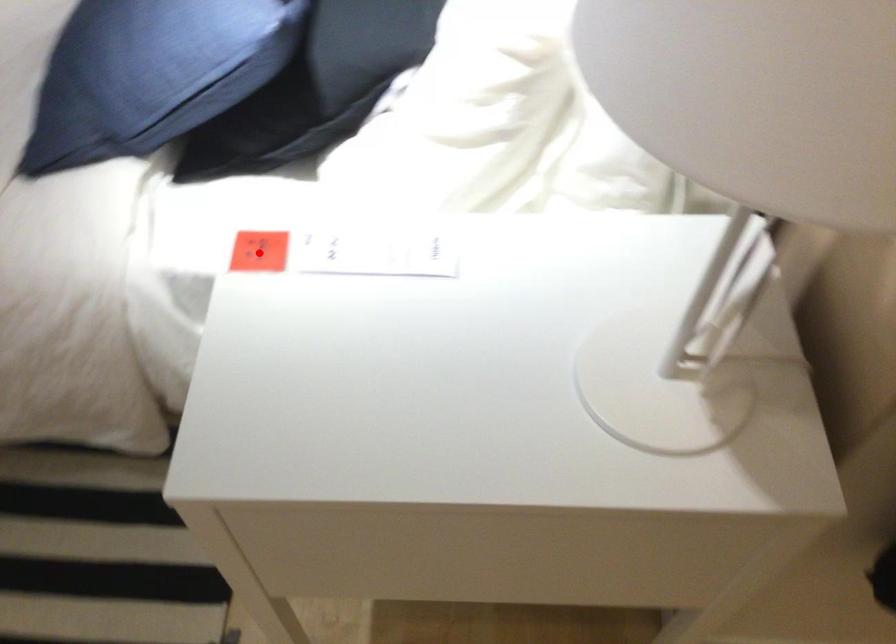
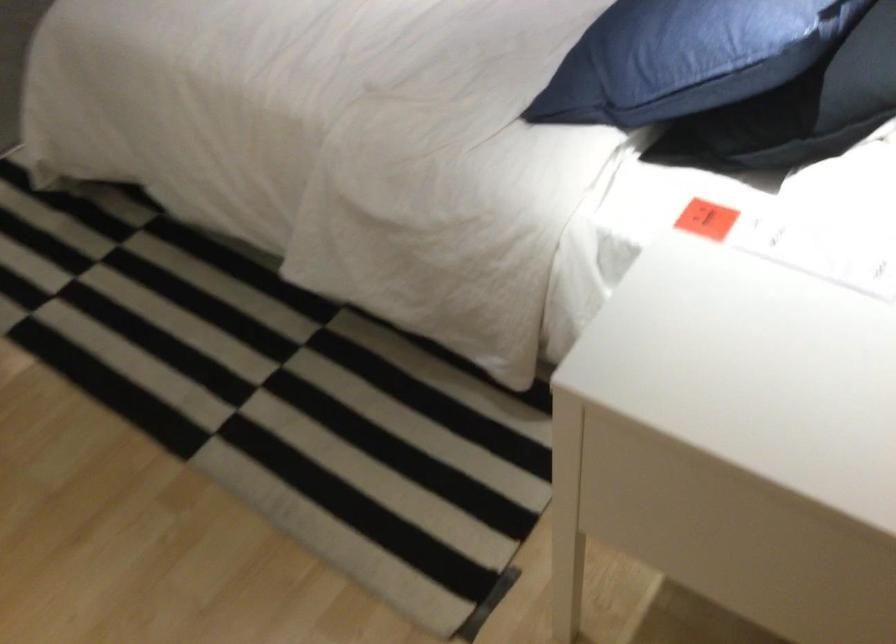
Where in the second image is the point corresponding to the highlighted location from the first image?

(707, 219)